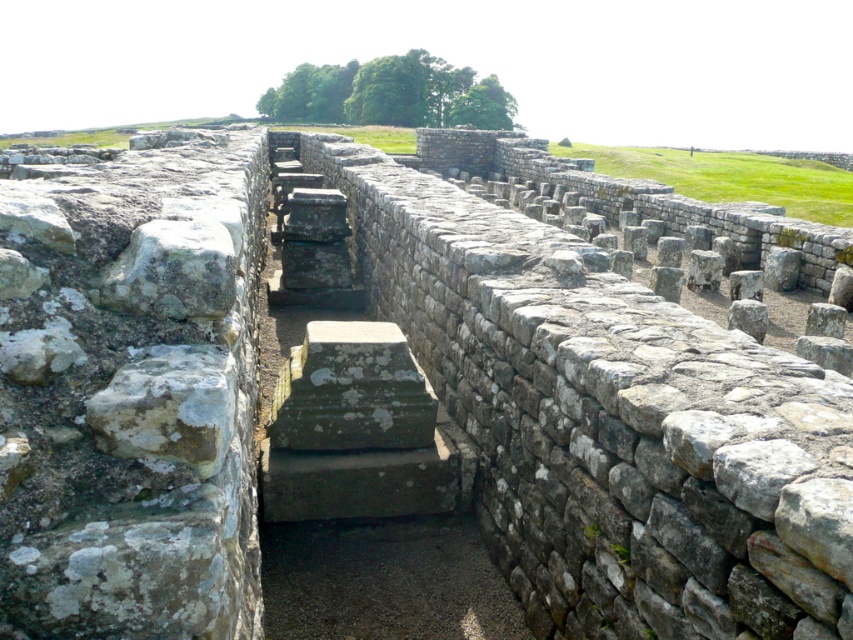
Question: Does gray stone stairs at center appear on the right side of weathered stone at left?

Choices:
 (A) yes
 (B) no

Answer: (B)

Question: Which object is positioned closest to the gray stone stairs at center?

Choices:
 (A) weathered stone at left
 (B) weathered stone wall at left

Answer: (A)

Question: Which object appears farthest from the camera in this image?

Choices:
 (A) weathered stone at left
 (B) gray stone stairs at center

Answer: (B)

Question: Which of these objects is positioned closest to the weathered stone at left?

Choices:
 (A) gray stone stairs at center
 (B) weathered stone wall at left

Answer: (A)

Question: Does gray stone stairs at center appear on the right side of weathered stone at left?

Choices:
 (A) yes
 (B) no

Answer: (B)

Question: Is weathered stone wall at left thinner than gray stone stairs at center?

Choices:
 (A) no
 (B) yes

Answer: (B)